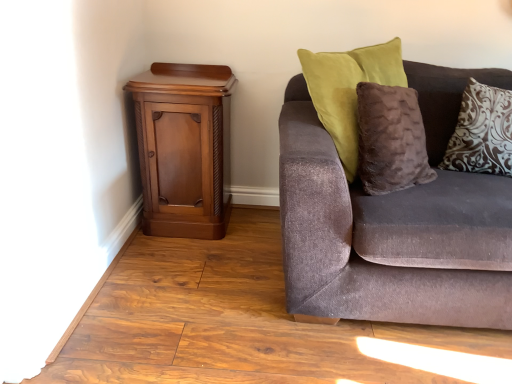
Question: Considering the positions of brown damask pillow at upper right and mahogany wood cabinet at left in the image, is brown damask pillow at upper right taller or shorter than mahogany wood cabinet at left?

Choices:
 (A) short
 (B) tall

Answer: (A)

Question: From the image's perspective, relative to mahogany wood cabinet at left, is brown damask pillow at upper right above or below?

Choices:
 (A) above
 (B) below

Answer: (A)

Question: Based on their relative distances, which object is nearer to the mahogany wood cabinet at left?

Choices:
 (A) brown damask pillow at upper right
 (B) velvet brown couch at right

Answer: (B)

Question: Considering the real-world distances, which object is farthest from the brown damask pillow at upper right?

Choices:
 (A) velvet brown couch at right
 (B) mahogany wood cabinet at left

Answer: (B)